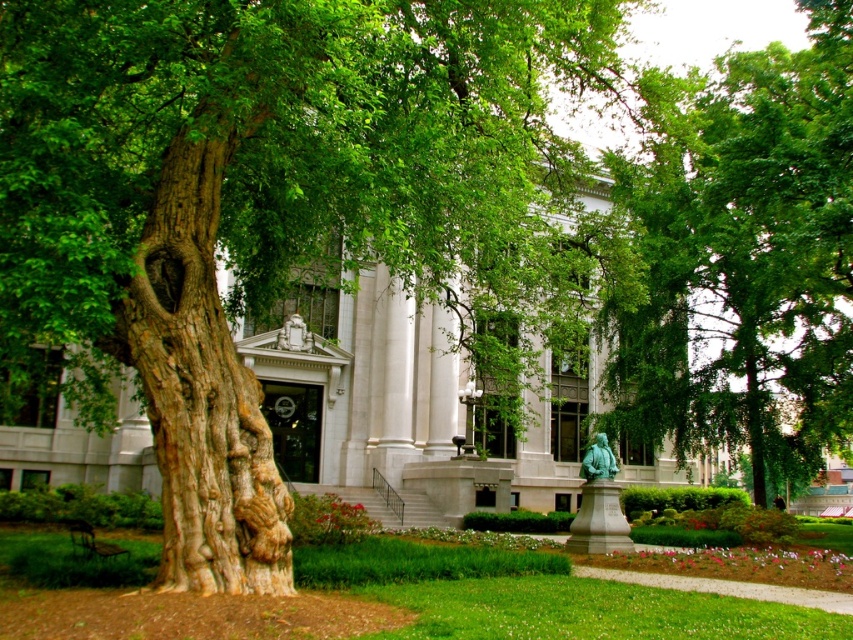
You are a park visitor who wants to take a photo of both the green patina statue at center and the green marble statue at center. However, the large tree is blocking part of your view. Which statue can you see more clearly in your current position?

The green patina statue at center is in front of the green marble statue at center, so the green patina statue at center is more visible and can be seen more clearly without obstruction from the tree.

You are standing at the statue near the center right of the park and want to reach the point marked at coordinates (279, 208). Which direction should you walk to get there?

The point at coordinates (279, 208) is on the green rough bark tree at left. Since you are at the statue near the center right, you should walk towards the left to reach the tree.

You are a park visitor who wants to take a photo of both the green patina statue at center and the green marble statue at center. Since you are standing at the entrance, which statue should you point your camera upwards to capture?

The green marble statue at center is above the green patina statue at center, so you should point your camera upwards to capture the green marble statue at center.